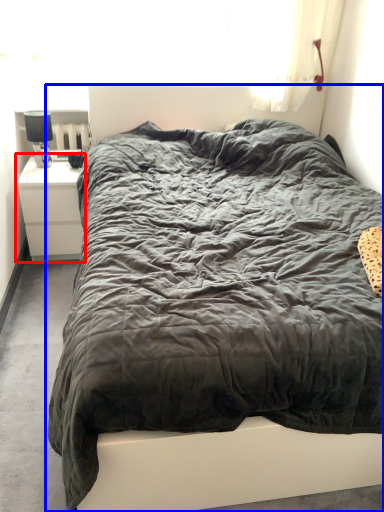
Question: Which object is closer to the camera taking this photo, nightstand (highlighted by a red box) or bed (highlighted by a blue box)?

Choices:
 (A) nightstand
 (B) bed

Answer: (B)